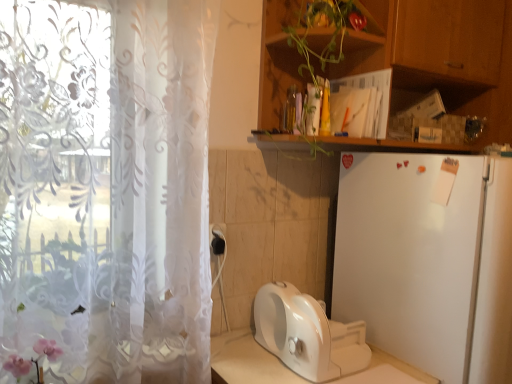
Question: Considering the relative sizes of black plastic electric outlet at lower center and wooden cabinet at upper right in the image provided, is black plastic electric outlet at lower center smaller than wooden cabinet at upper right?

Choices:
 (A) no
 (B) yes

Answer: (B)

Question: From a real-world perspective, is black plastic electric outlet at lower center physically above wooden cabinet at upper right?

Choices:
 (A) no
 (B) yes

Answer: (A)

Question: From the image's perspective, would you say black plastic electric outlet at lower center is positioned over wooden cabinet at upper right?

Choices:
 (A) no
 (B) yes

Answer: (A)

Question: Can you confirm if black plastic electric outlet at lower center is shorter than wooden cabinet at upper right?

Choices:
 (A) yes
 (B) no

Answer: (A)

Question: Is the surface of black plastic electric outlet at lower center in direct contact with wooden cabinet at upper right?

Choices:
 (A) yes
 (B) no

Answer: (B)

Question: From a real-world perspective, is white glossy toaster at lower center physically located above or below white matte refrigerator at right?

Choices:
 (A) above
 (B) below

Answer: (B)

Question: Considering the positions of white glossy toaster at lower center and white matte refrigerator at right in the image, is white glossy toaster at lower center bigger or smaller than white matte refrigerator at right?

Choices:
 (A) big
 (B) small

Answer: (B)

Question: Considering the relative positions of white glossy toaster at lower center and white matte refrigerator at right in the image provided, is white glossy toaster at lower center to the left or to the right of white matte refrigerator at right?

Choices:
 (A) left
 (B) right

Answer: (A)

Question: Would you say white glossy toaster at lower center is inside or outside white matte refrigerator at right?

Choices:
 (A) outside
 (B) inside

Answer: (A)

Question: Considering the positions of pink floral decoration at lower left and black plastic electric outlet at lower center in the image, is pink floral decoration at lower left wider or thinner than black plastic electric outlet at lower center?

Choices:
 (A) thin
 (B) wide

Answer: (B)

Question: From a real-world perspective, is pink floral decoration at lower left above or below black plastic electric outlet at lower center?

Choices:
 (A) above
 (B) below

Answer: (B)

Question: Visually, is pink floral decoration at lower left positioned to the left or to the right of black plastic electric outlet at lower center?

Choices:
 (A) left
 (B) right

Answer: (A)

Question: Is pink floral decoration at lower left taller or shorter than black plastic electric outlet at lower center?

Choices:
 (A) tall
 (B) short

Answer: (A)

Question: Considering the positions of white glossy toaster at lower center and black plastic electric outlet at lower center in the image, is white glossy toaster at lower center taller or shorter than black plastic electric outlet at lower center?

Choices:
 (A) short
 (B) tall

Answer: (B)

Question: Do you think white glossy toaster at lower center is within black plastic electric outlet at lower center, or outside of it?

Choices:
 (A) inside
 (B) outside

Answer: (B)